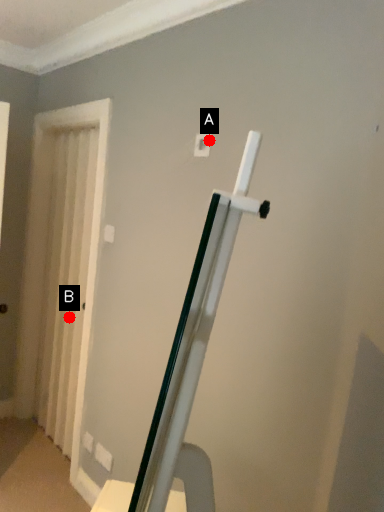
Question: Two points are circled on the image, labeled by A and B beside each circle. Which of the following is the closest to the observer?

Choices:
 (A) A is closer
 (B) B is closer

Answer: (A)